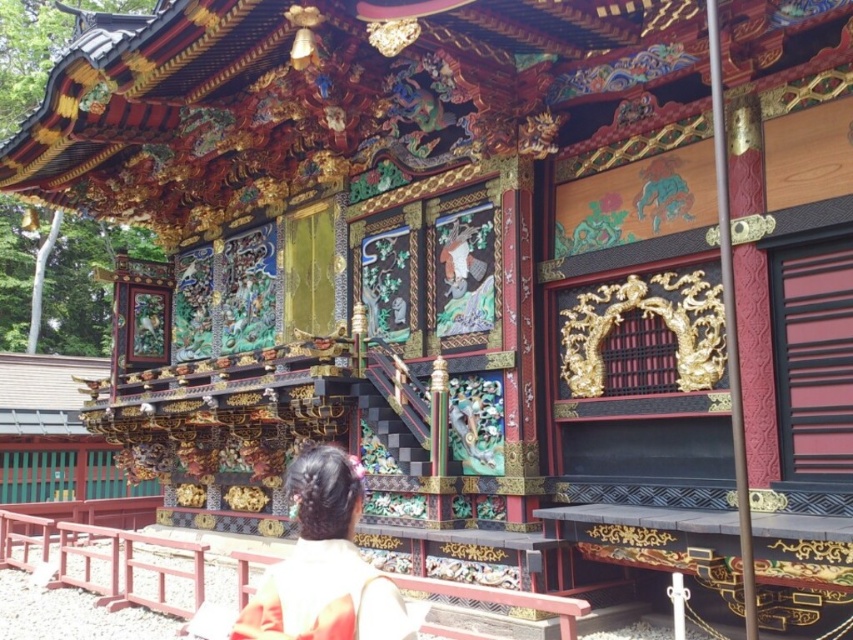
Is wooden bench at lower center thinner than silk kimono at center?

No, wooden bench at lower center is not thinner than silk kimono at center.

Between point (4, 556) and point (289, 568), which one is positioned behind?

The point (4, 556) is more distant.

Locate an element on the screen. wooden bench at lower center is located at coordinates (108, 563).